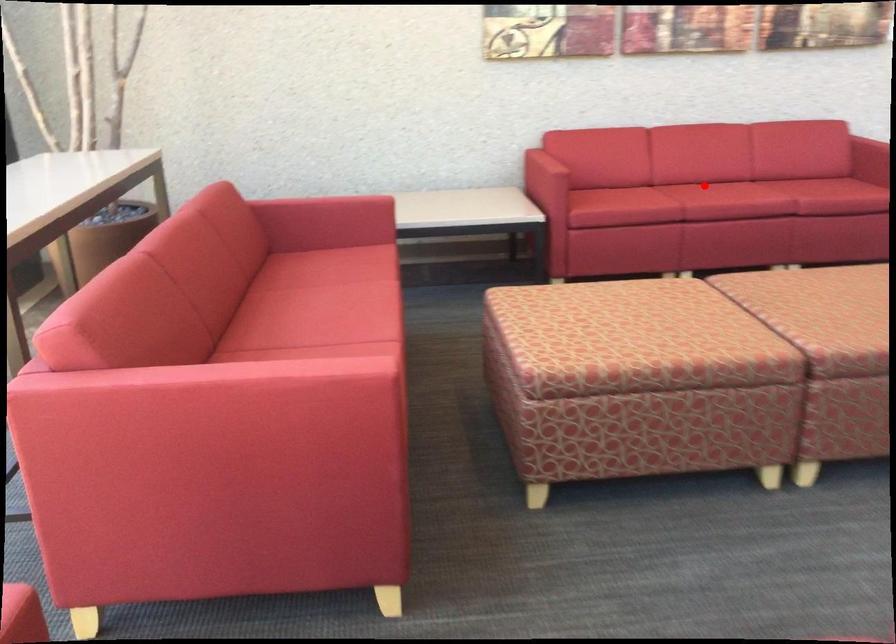
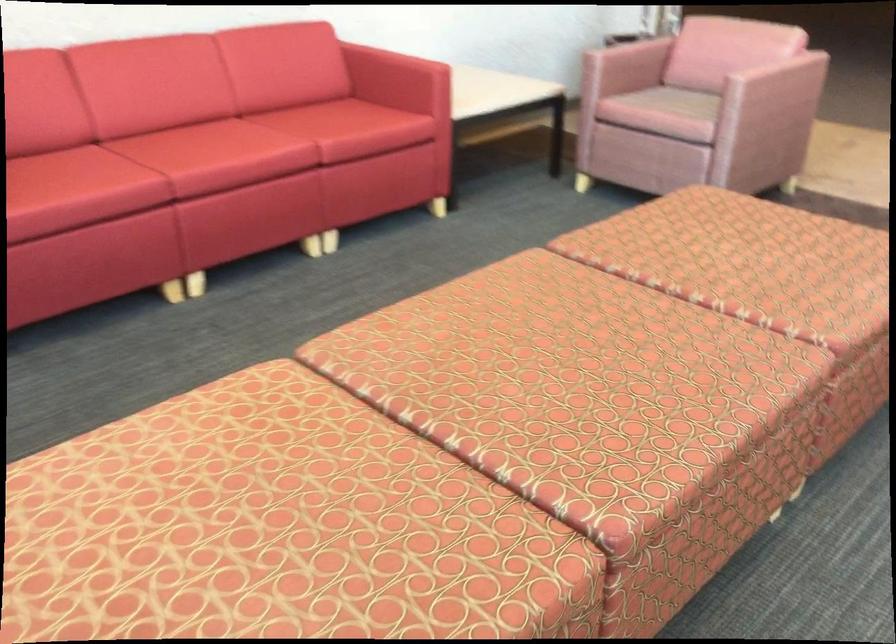
Question: A red point is marked in image1. In image2, is the corresponding 3D point closer to the camera or farther? Reply with the corresponding letter.

Choices:
 (A) The corresponding 3D point is closer.
 (B) The corresponding 3D point is farther.

Answer: (A)